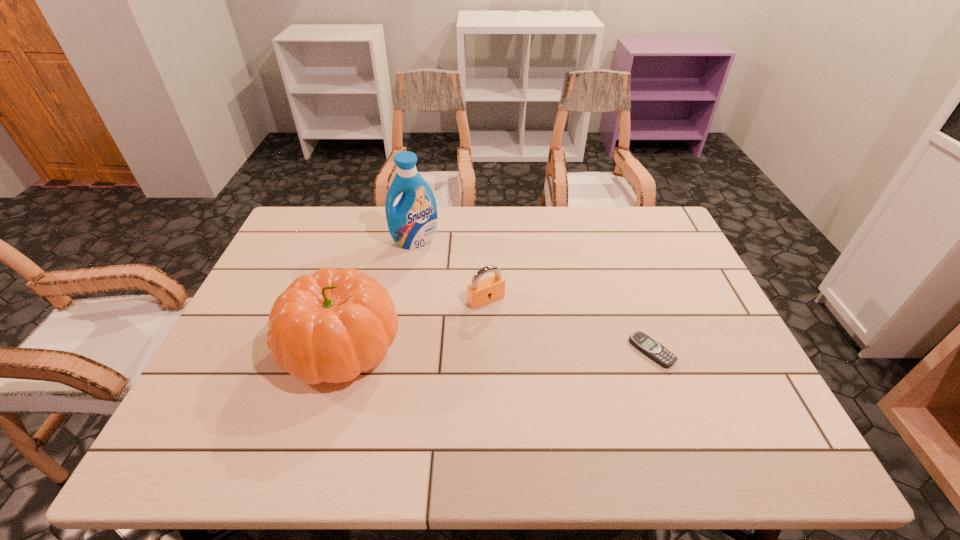
At what (x,y) coordinates should I click in order to perform the action: click on the second tallest object. Please return your answer as a coordinate pair (x, y). Image resolution: width=960 pixels, height=540 pixels. Looking at the image, I should click on (330, 326).

Identify the location of the shortest object. click(x=647, y=345).

Where is `beeper`? beeper is located at coordinates (647, 345).

Find the location of a particular element. Image resolution: width=960 pixels, height=540 pixels. the farthest object is located at coordinates (412, 222).

Identify the location of the tallest object. The height and width of the screenshot is (540, 960). (412, 222).

This screenshot has width=960, height=540. What are the coordinates of `padlock` in the screenshot? It's located at (479, 293).

Locate an element on the screen. The image size is (960, 540). the third tallest object is located at coordinates (479, 293).

Identify the location of free space located on the carved face of the pumpkin. The image size is (960, 540). (254, 346).

Image resolution: width=960 pixels, height=540 pixels. I want to click on free location located on the back of the rightmost object, so click(615, 252).

Identify the location of vacant space located on the front-facing side of the detergent. (450, 338).